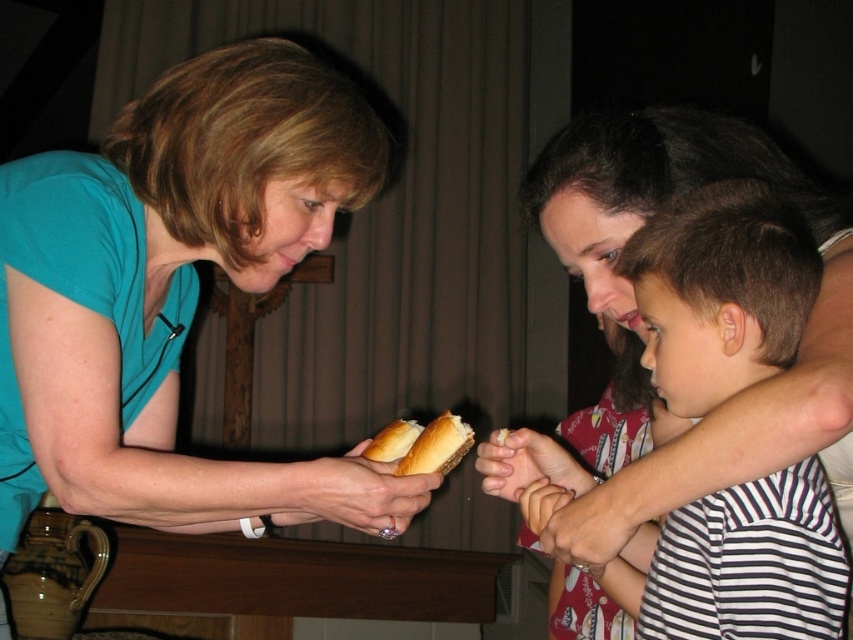
Is matte teal shirt at left in front of striped cotton shirt at center?

That is False.

Locate an element on the screen. matte teal shirt at left is located at coordinates (175, 292).

Which is in front, point (325, 140) or point (711, 355)?

Positioned in front is point (711, 355).

The height and width of the screenshot is (640, 853). Identify the location of matte teal shirt at left. (175, 292).

Consider the image. Does striped cotton shirt at center appear on the left side of golden bread roll at center?

In fact, striped cotton shirt at center is to the right of golden bread roll at center.

Does striped cotton shirt at center have a lesser height compared to golden bread roll at center?

No, striped cotton shirt at center is not shorter than golden bread roll at center.

Locate an element on the screen. Image resolution: width=853 pixels, height=640 pixels. striped cotton shirt at center is located at coordinates (720, 291).

Locate an element on the screen. striped cotton shirt at center is located at coordinates (720, 291).

Is matte teal shirt at left smaller than golden bread roll at center?

No, matte teal shirt at left is not smaller than golden bread roll at center.

Does matte teal shirt at left have a larger size compared to golden bread roll at center?

Correct, matte teal shirt at left is larger in size than golden bread roll at center.

From the picture: Who is more distant from viewer, (160, 156) or (381, 460)?

Positioned behind is point (381, 460).

You are a GUI agent. You are given a task and a screenshot of the screen. Output one action in this format:
    pyautogui.click(x=<x>, y=<y>)
    Task: Click on the matte teal shirt at left
    The width and height of the screenshot is (853, 640).
    Given the screenshot: What is the action you would take?
    pyautogui.click(x=175, y=292)